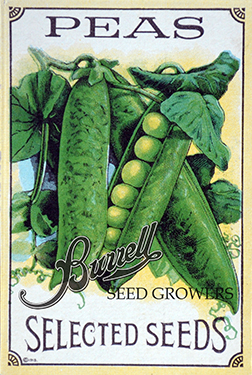
You are a GUI agent. You are given a task and a screenshot of the screen. Output one action in this format:
    pyautogui.click(x=<x>, y=<y>)
    Task: Click on the fans in the corner in black outline
    The image size is (252, 375).
    Given the screenshot: What is the action you would take?
    (236, 361), (14, 361), (14, 14), (238, 15)